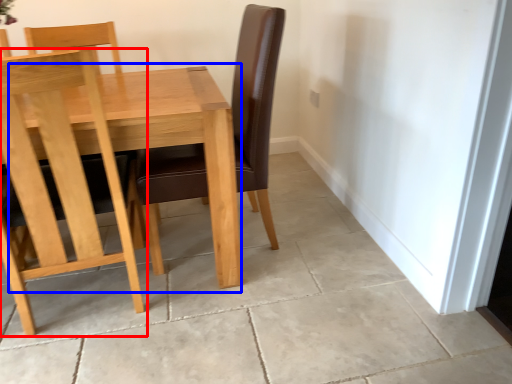
Question: Which of the following is the farthest to the observer, chair (highlighted by a red box) or table (highlighted by a blue box)?

Choices:
 (A) chair
 (B) table

Answer: (B)